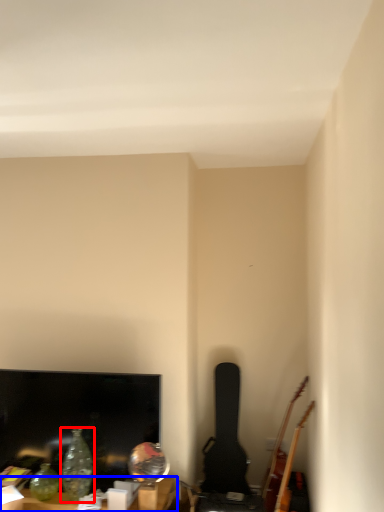
Question: Which point is further to the camera, glass vase (highlighted by a red box) or furniture (highlighted by a blue box)?

Choices:
 (A) glass vase
 (B) furniture

Answer: (A)